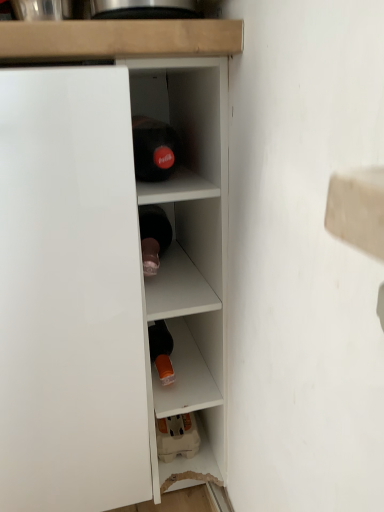
Question: Is white glossy cupboard at left bigger than white glossy cabinet at center?

Choices:
 (A) yes
 (B) no

Answer: (A)

Question: Is white glossy cabinet at center located within white glossy cupboard at left?

Choices:
 (A) no
 (B) yes

Answer: (A)

Question: From the image's perspective, would you say white glossy cupboard at left is shown under white glossy cabinet at center?

Choices:
 (A) yes
 (B) no

Answer: (A)

Question: Considering the relative sizes of white glossy cupboard at left and white glossy cabinet at center in the image provided, is white glossy cupboard at left wider than white glossy cabinet at center?

Choices:
 (A) yes
 (B) no

Answer: (A)

Question: Can you confirm if white glossy cupboard at left is smaller than white glossy cabinet at center?

Choices:
 (A) yes
 (B) no

Answer: (B)

Question: Is white glossy cupboard at left looking in the opposite direction of white glossy cabinet at center?

Choices:
 (A) no
 (B) yes

Answer: (A)

Question: Could white glossy cupboard at left be considered to be inside white glossy cabinet at center?

Choices:
 (A) yes
 (B) no

Answer: (B)

Question: Can you confirm if white glossy cabinet at center is positioned to the left of white glossy cupboard at left?

Choices:
 (A) no
 (B) yes

Answer: (A)

Question: From a real-world perspective, is white glossy cabinet at center located beneath white glossy cupboard at left?

Choices:
 (A) yes
 (B) no

Answer: (B)

Question: From the image's perspective, is white glossy cabinet at center under white glossy cupboard at left?

Choices:
 (A) no
 (B) yes

Answer: (A)

Question: Is white glossy cabinet at center wider than white glossy cupboard at left?

Choices:
 (A) yes
 (B) no

Answer: (B)

Question: Is there a large distance between white glossy cabinet at center and white glossy cupboard at left?

Choices:
 (A) yes
 (B) no

Answer: (B)

Question: Is white glossy cupboard at left situated inside white glossy cabinet at center or outside?

Choices:
 (A) inside
 (B) outside

Answer: (B)